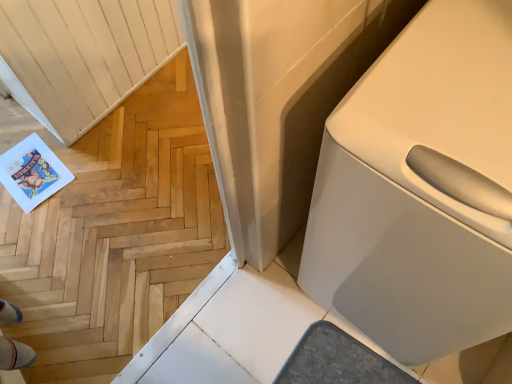
This screenshot has height=384, width=512. What do you see at coordinates (421, 189) in the screenshot?
I see `white glossy toilet at right` at bounding box center [421, 189].

The image size is (512, 384). In order to click on white glossy toilet at right in this screenshot , I will do `click(421, 189)`.

The width and height of the screenshot is (512, 384). Describe the element at coordinates (113, 232) in the screenshot. I see `natural wood floor at lower left` at that location.

Image resolution: width=512 pixels, height=384 pixels. In order to click on natural wood floor at lower left in this screenshot , I will do `click(113, 232)`.

Where is `white glossy toilet at right`? white glossy toilet at right is located at coordinates (421, 189).

In the image, is natural wood floor at lower left on the left side or the right side of white glossy toilet at right?

natural wood floor at lower left is to the left of white glossy toilet at right.

Is natural wood floor at lower left in front of white glossy toilet at right?

Yes, natural wood floor at lower left is closer to the viewer.

Is point (74, 366) less distant than point (438, 166)?

No, (74, 366) is further to viewer.

From the image's perspective, relative to white glossy toilet at right, is natural wood floor at lower left above or below?

From the image's perspective, natural wood floor at lower left appears below white glossy toilet at right.

Consider the image. From a real-world perspective, is natural wood floor at lower left below white glossy toilet at right?

No, from a real-world perspective, natural wood floor at lower left is not below white glossy toilet at right.

Between natural wood floor at lower left and white glossy toilet at right, which one has larger width?

Wider between the two is white glossy toilet at right.

Which of these two, natural wood floor at lower left or white glossy toilet at right, stands taller?

natural wood floor at lower left.

Which of these two, natural wood floor at lower left or white glossy toilet at right, is smaller?

With smaller size is natural wood floor at lower left.

Would you say natural wood floor at lower left is outside white glossy toilet at right?

Yes, natural wood floor at lower left is located beyond the bounds of white glossy toilet at right.

Is natural wood floor at lower left beside white glossy toilet at right?

No.

Is white glossy toilet at right at the back of natural wood floor at lower left?

No, white glossy toilet at right is not at the back of natural wood floor at lower left.

How many degrees apart are the facing directions of natural wood floor at lower left and white glossy toilet at right?

The angle between the facing direction of natural wood floor at lower left and the facing direction of white glossy toilet at right is 89.7 degrees.

Where is `home appliance behind the natural wood floor at lower left`? home appliance behind the natural wood floor at lower left is located at coordinates (421, 189).

Can you confirm if white glossy toilet at right is positioned to the right of natural wood floor at lower left?

Correct, you'll find white glossy toilet at right to the right of natural wood floor at lower left.

In the image, is white glossy toilet at right positioned in front of or behind natural wood floor at lower left?

white glossy toilet at right is behind natural wood floor at lower left.

Which is less distant, (x=409, y=231) or (x=70, y=302)?

Point (x=409, y=231)

From the image's perspective, is white glossy toilet at right located beneath natural wood floor at lower left?

No, from the image's perspective, white glossy toilet at right is not below natural wood floor at lower left.

From a real-world perspective, who is located lower, white glossy toilet at right or natural wood floor at lower left?

From a 3D spatial view, white glossy toilet at right is below.

Can you confirm if white glossy toilet at right is thinner than natural wood floor at lower left?

No.

Considering the relative sizes of white glossy toilet at right and natural wood floor at lower left in the image provided, is white glossy toilet at right taller than natural wood floor at lower left?

Incorrect, the height of white glossy toilet at right is not larger of that of natural wood floor at lower left.

Considering the sizes of white glossy toilet at right and natural wood floor at lower left in the image, is white glossy toilet at right bigger or smaller than natural wood floor at lower left?

In the image, white glossy toilet at right appears to be larger than natural wood floor at lower left.

Choose the correct answer: Is white glossy toilet at right inside natural wood floor at lower left or outside it?

white glossy toilet at right exists outside the volume of natural wood floor at lower left.

Is white glossy toilet at right next to natural wood floor at lower left and touching it?

white glossy toilet at right and natural wood floor at lower left are not in contact.

Is white glossy toilet at right facing towards natural wood floor at lower left?

No, white glossy toilet at right is not turned towards natural wood floor at lower left.

How different are the orientations of white glossy toilet at right and natural wood floor at lower left in degrees?

white glossy toilet at right and natural wood floor at lower left are facing 89.7 degrees away from each other.

Find the location of a particular element. stairwell above the white glossy toilet at right (from a real-world perspective) is located at coordinates (113, 232).

You are a GUI agent. You are given a task and a screenshot of the screen. Output one action in this format:
    pyautogui.click(x=<x>, y=<y>)
    Task: Click on the stairwell lying below the white glossy toilet at right (from the image's perspective)
    The height and width of the screenshot is (384, 512).
    Given the screenshot: What is the action you would take?
    pyautogui.click(x=113, y=232)

Find the location of a particular element. home appliance below the natural wood floor at lower left (from a real-world perspective) is located at coordinates (421, 189).